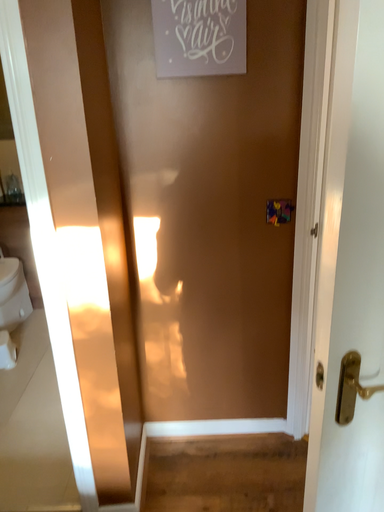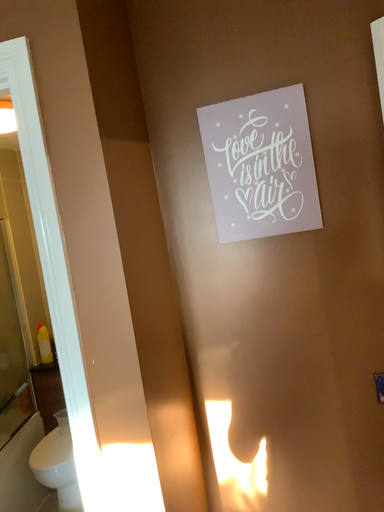
Question: Which way did the camera rotate in the video?

Choices:
 (A) rotated downward
 (B) rotated upward

Answer: (B)